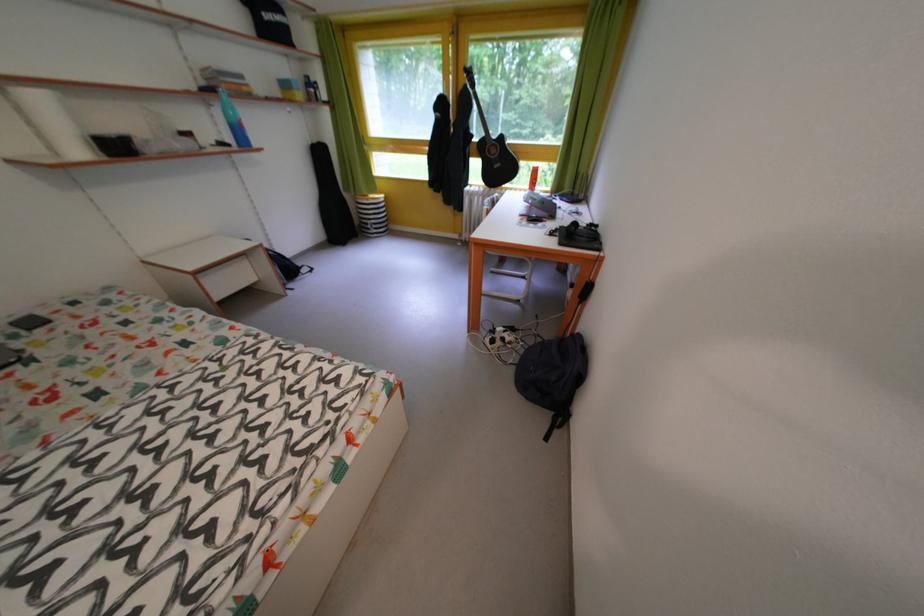
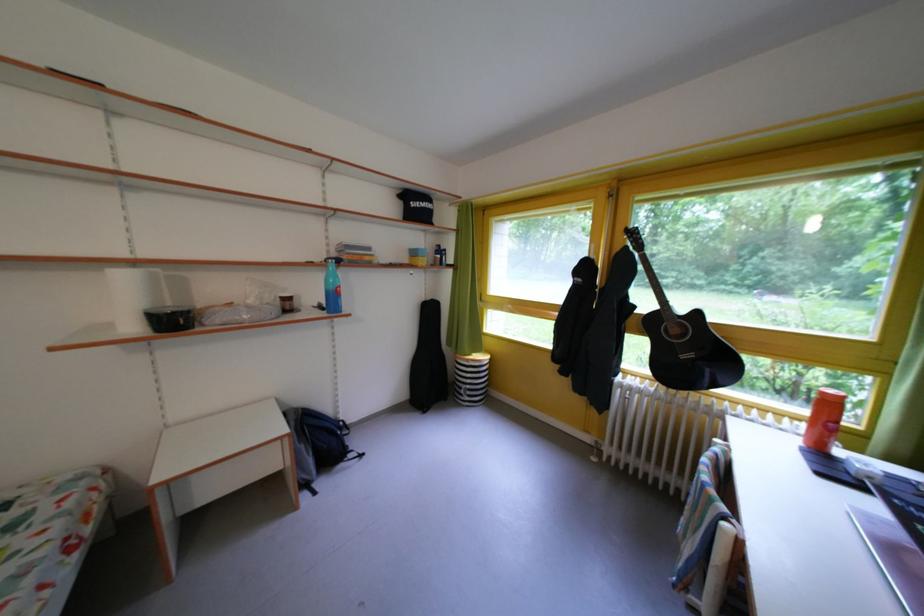
Locate, in the second image, the point that corresponds to (x=332, y=243) in the first image.

(415, 400)